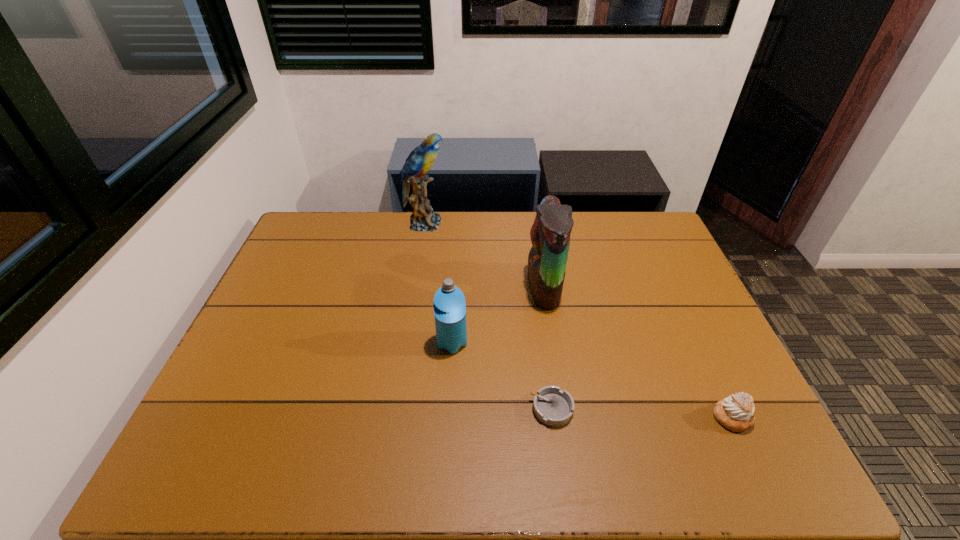
You are a GUI agent. You are given a task and a screenshot of the screen. Output one action in this format:
    pyautogui.click(x=<x>, y=<y>)
    Task: Click on the free region located at the face of the fourth shortest object
    
    Given the screenshot: What is the action you would take?
    408,287

Locate an element on the screen. Image resolution: width=960 pixels, height=540 pixels. free point located at the face of the fourth shortest object is located at coordinates (479, 287).

Locate an element on the screen. The image size is (960, 540). vacant space located 0.260m at the face of the fourth shortest object is located at coordinates (444, 287).

You are a GUI agent. You are given a task and a screenshot of the screen. Output one action in this format:
    pyautogui.click(x=<x>, y=<y>)
    Task: Click on the vacant region located on the right of the thermos bottle
    
    Given the screenshot: What is the action you would take?
    pyautogui.click(x=607, y=343)

Where is `vacant space located 0.280m on the back of the rightmost object`? vacant space located 0.280m on the back of the rightmost object is located at coordinates (684, 316).

This screenshot has width=960, height=540. I want to click on vacant space located on the right of the shortest object, so click(657, 409).

Identify the location of object at the far edge. (421, 159).

This screenshot has height=540, width=960. In order to click on object located in the right edge section of the desktop in this screenshot , I will do `click(736, 412)`.

In the image, there is a desktop. Find the location of `vacant space at the far edge`. vacant space at the far edge is located at coordinates (414, 241).

The height and width of the screenshot is (540, 960). I want to click on vacant space at the near edge, so click(x=563, y=478).